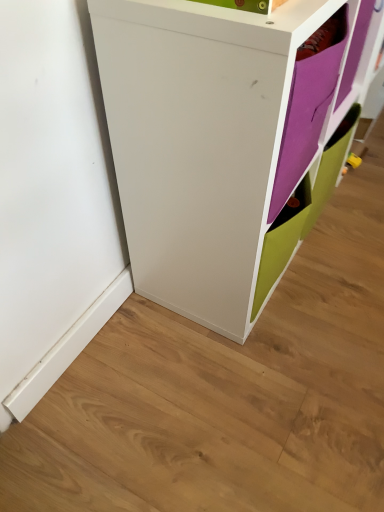
Measure the distance between point (289,106) and camera.

Point (289,106) is 62.20 centimeters from camera.

At what (x,y) coordinates should I click in order to perform the action: click on white matte cabinet at center. Please return your answer as a coordinate pair (x, y). Looking at the image, I should click on (221, 138).

Image resolution: width=384 pixels, height=512 pixels. Describe the element at coordinates (221, 138) in the screenshot. I see `white matte cabinet at center` at that location.

Image resolution: width=384 pixels, height=512 pixels. Describe the element at coordinates (308, 104) in the screenshot. I see `purple matte paper at upper right` at that location.

The height and width of the screenshot is (512, 384). I want to click on purple matte paper at upper right, so click(x=308, y=104).

I want to click on white matte cabinet at center, so click(221, 138).

Between white matte cabinet at center and purple matte paper at upper right, which one appears on the right side from the viewer's perspective?

purple matte paper at upper right is more to the right.

Which is in front, white matte cabinet at center or purple matte paper at upper right?

white matte cabinet at center is more forward.

Does point (218, 157) lie behind point (316, 86)?

Yes, it is.

From the image's perspective, which is below, white matte cabinet at center or purple matte paper at upper right?

purple matte paper at upper right appears lower in the image.

From a real-world perspective, which is physically above, white matte cabinet at center or purple matte paper at upper right?

purple matte paper at upper right, from a real-world perspective.

Considering the sizes of objects white matte cabinet at center and purple matte paper at upper right in the image provided, who is thinner, white matte cabinet at center or purple matte paper at upper right?

With smaller width is purple matte paper at upper right.

Is white matte cabinet at center taller than purple matte paper at upper right?

Indeed, white matte cabinet at center has a greater height compared to purple matte paper at upper right.

Who is smaller, white matte cabinet at center or purple matte paper at upper right?

Smaller between the two is purple matte paper at upper right.

Could purple matte paper at upper right be considered to be inside white matte cabinet at center?

Absolutely, purple matte paper at upper right is inside white matte cabinet at center.

Is white matte cabinet at center far away from purple matte paper at upper right?

No, white matte cabinet at center is not far from purple matte paper at upper right.

Is white matte cabinet at center facing towards purple matte paper at upper right?

Yes, white matte cabinet at center is aimed at purple matte paper at upper right.

The image size is (384, 512). In order to click on cupboard on the left of the purple matte paper at upper right in this screenshot , I will do `click(221, 138)`.

Is purple matte paper at upper right at the left side of white matte cabinet at center?

No.

Which is behind, purple matte paper at upper right or white matte cabinet at center?

purple matte paper at upper right is further away from the camera.

Does point (310, 85) lie in front of point (247, 238)?

Yes.

From the image's perspective, is purple matte paper at upper right located beneath white matte cabinet at center?

Yes, from the image's perspective, purple matte paper at upper right is beneath white matte cabinet at center.

From a real-world perspective, which is physically below, purple matte paper at upper right or white matte cabinet at center?

From a 3D spatial view, white matte cabinet at center is below.

Does purple matte paper at upper right have a greater width compared to white matte cabinet at center?

No, purple matte paper at upper right is not wider than white matte cabinet at center.

Does purple matte paper at upper right have a greater height compared to white matte cabinet at center?

Incorrect, the height of purple matte paper at upper right is not larger of that of white matte cabinet at center.

Considering the sizes of purple matte paper at upper right and white matte cabinet at center in the image, is purple matte paper at upper right bigger or smaller than white matte cabinet at center?

Considering their sizes, purple matte paper at upper right takes up less space than white matte cabinet at center.

Is purple matte paper at upper right inside the boundaries of white matte cabinet at center, or outside?

purple matte paper at upper right is located inside white matte cabinet at center.

Can you see purple matte paper at upper right touching white matte cabinet at center?

No, purple matte paper at upper right is not making contact with white matte cabinet at center.

Is purple matte paper at upper right facing away from white matte cabinet at center?

Yes, purple matte paper at upper right is facing away from white matte cabinet at center.

Can you tell me how much purple matte paper at upper right and white matte cabinet at center differ in facing direction?

They differ by 0.35 degrees in their facing directions.

At what (x,y) coordinates should I click in order to perform the action: click on shelf that appears on the right of white matte cabinet at center. Please return your answer as a coordinate pair (x, y). Looking at the image, I should click on (308, 104).

Image resolution: width=384 pixels, height=512 pixels. In the image, there is a purple matte paper at upper right. Find the location of `cupboard above it (from the image's perspective)`. cupboard above it (from the image's perspective) is located at coordinates (221, 138).

Where is `shelf above the white matte cabinet at center (from a real-world perspective)`? shelf above the white matte cabinet at center (from a real-world perspective) is located at coordinates coord(308,104).